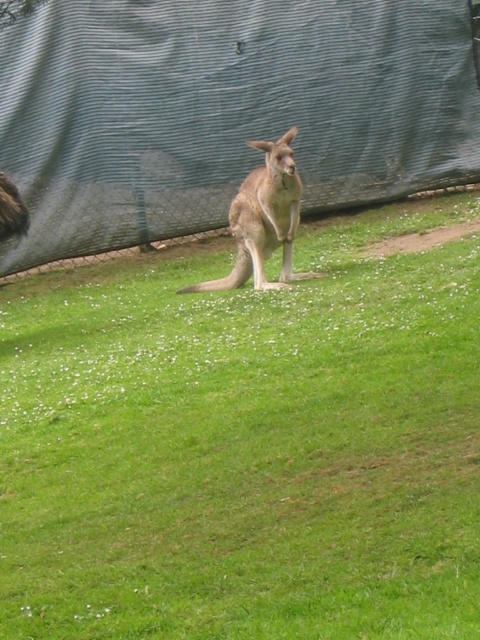
Which is in front, point (22, 476) or point (240, 243)?

Positioned in front is point (22, 476).

You are a GUI agent. You are given a task and a screenshot of the screen. Output one action in this format:
    pyautogui.click(x=<x>, y=<y>)
    Task: Click on the brown fur kangaroo at center
    The image size is (480, 640).
    Given the screenshot: What is the action you would take?
    [247, 444]